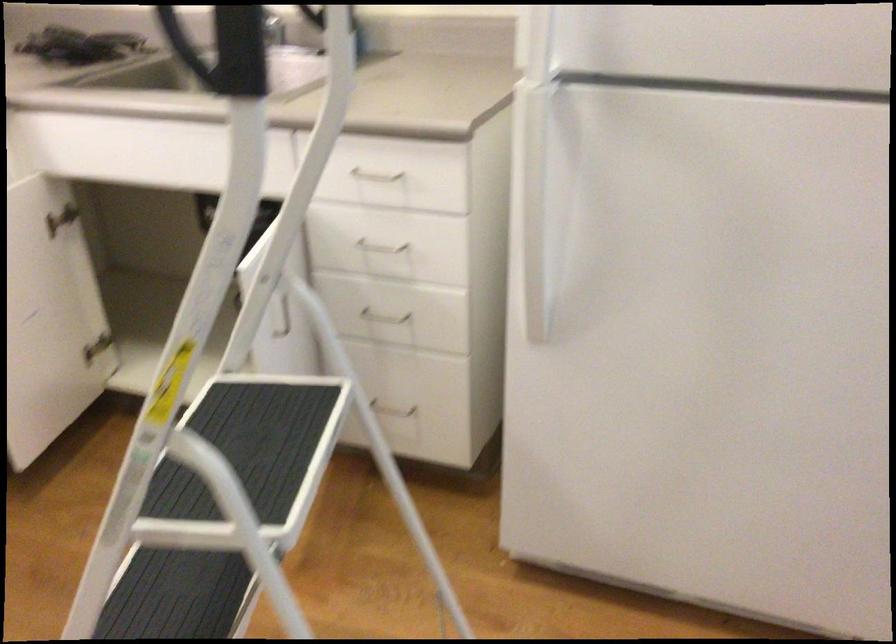
Image resolution: width=896 pixels, height=644 pixels. Describe the element at coordinates (530, 203) in the screenshot. I see `the white refrigerator handle` at that location.